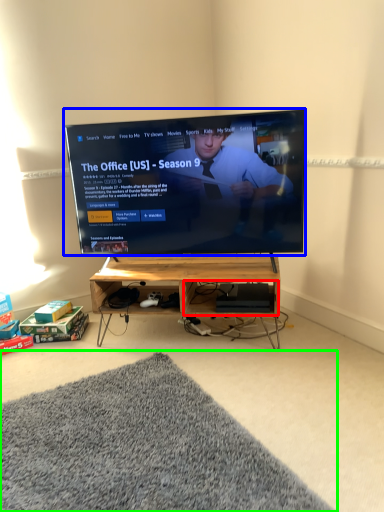
Question: Based on their relative distances, which object is nearer to shelf (highlighted by a red box)? Choose from television (highlighted by a blue box) and mat (highlighted by a green box).

Choices:
 (A) television
 (B) mat

Answer: (A)